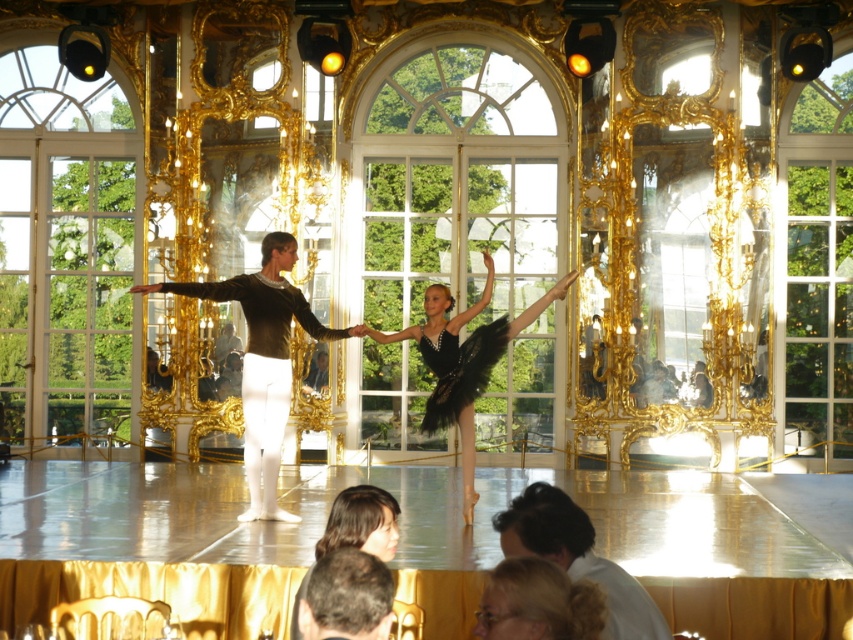
Is the position of blonde hair at lower center less distant than that of brown hair at center?

Yes, it is.

Is blonde hair at lower center thinner than brown hair at center?

No, blonde hair at lower center is not thinner than brown hair at center.

Is point (514, 584) less distant than point (318, 580)?

Yes, it is in front of point (318, 580).

This screenshot has width=853, height=640. Identify the location of blonde hair at lower center. pos(538,604).

Can you confirm if black tulle skirt at center is positioned to the left of white shirt at center?

Yes, black tulle skirt at center is to the left of white shirt at center.

Is the position of black tulle skirt at center more distant than that of white shirt at center?

That is True.

Is point (465, 452) farther from viewer compared to point (607, 566)?

Yes, it is behind point (607, 566).

Where is `black tulle skirt at center`? This screenshot has width=853, height=640. black tulle skirt at center is located at coordinates (463, 360).

Which of these two, white shirt at center or brown hair at center, stands shorter?

Standing shorter between the two is brown hair at center.

Is white shirt at center thinner than brown hair at center?

Incorrect, white shirt at center's width is not less than brown hair at center's.

Which is behind, point (503, 515) or point (350, 604)?

Positioned behind is point (503, 515).

Find the location of a particular element. This screenshot has width=853, height=640. white shirt at center is located at coordinates (577, 557).